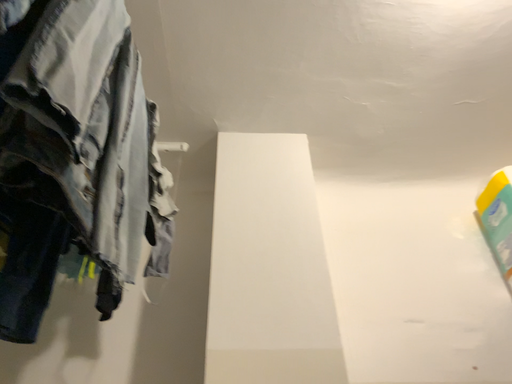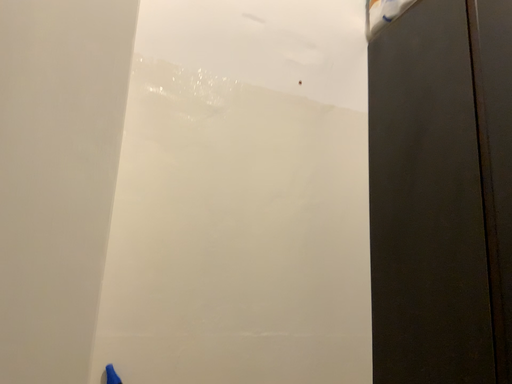
Question: Which way did the camera rotate in the video?

Choices:
 (A) rotated left
 (B) rotated right

Answer: (B)